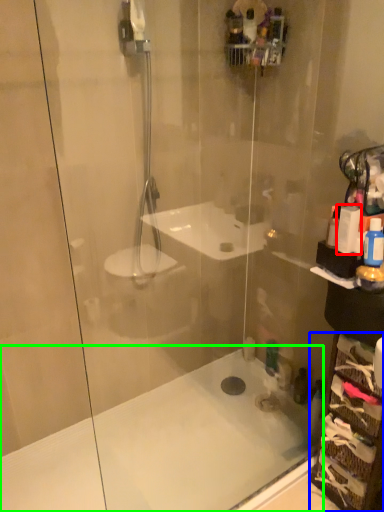
Question: Estimate the real-world distances between objects in this image. Which object is closer to toiletry (highlighted by a red box), glass box (highlighted by a blue box) or bath (highlighted by a green box)?

Choices:
 (A) glass box
 (B) bath

Answer: (A)